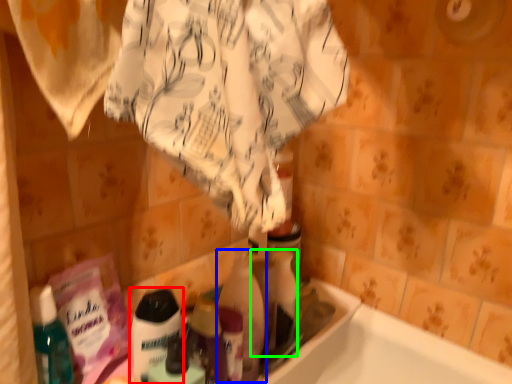
Question: Which is nearer to the cleaning product (highlighted by a red box)? cleaning product (highlighted by a blue box) or cleaning product (highlighted by a green box).

Choices:
 (A) cleaning product
 (B) cleaning product

Answer: (A)